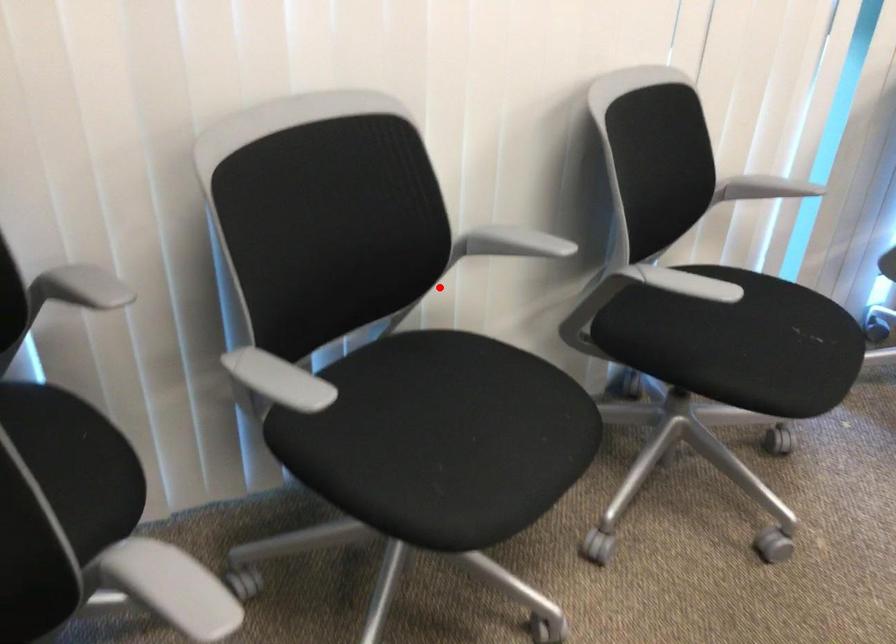
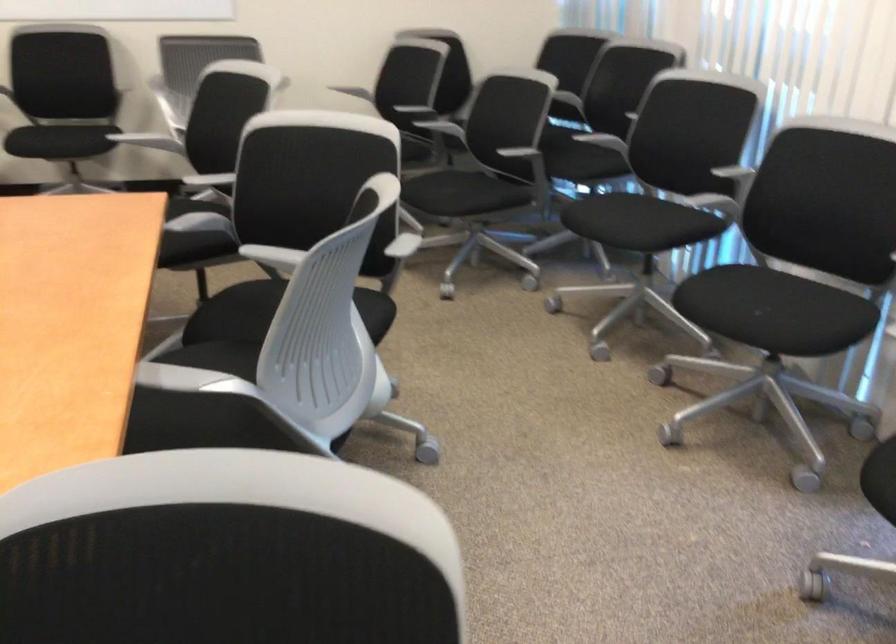
The point at the highlighted location is marked in the first image. Where is the corresponding point in the second image?

(726, 193)